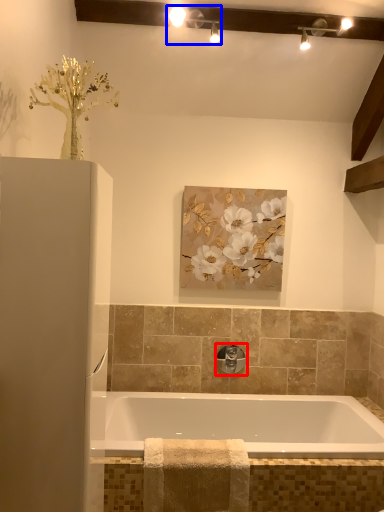
Question: Which of the following is the closest to the observer, tap (highlighted by a red box) or light fixture (highlighted by a blue box)?

Choices:
 (A) tap
 (B) light fixture

Answer: (B)